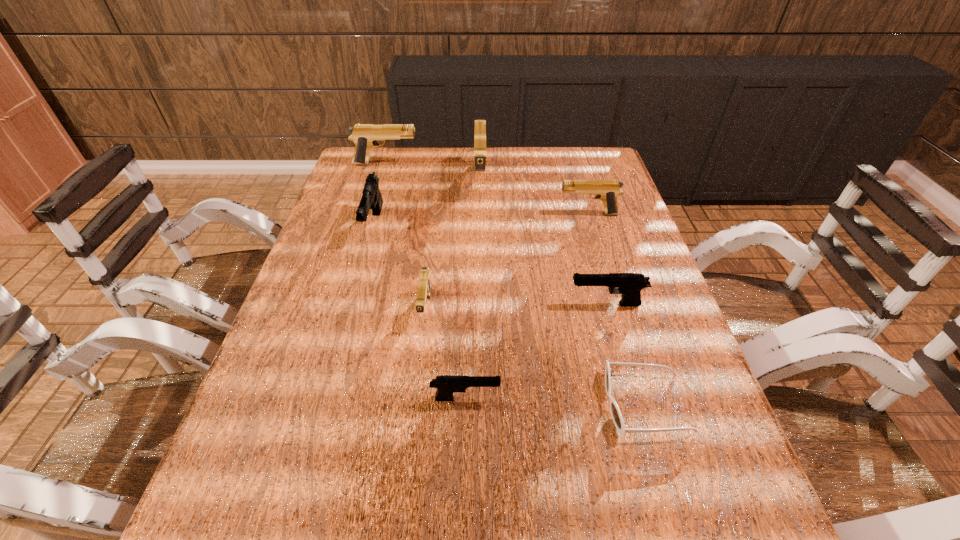
At what (x,y) coordinates should I click in order to perform the action: click on the third tan pistol from right to left. Please return your answer as a coordinate pair (x, y). The height and width of the screenshot is (540, 960). Looking at the image, I should click on (424, 288).

This screenshot has height=540, width=960. I want to click on the smallest black pistol, so click(x=446, y=385).

The height and width of the screenshot is (540, 960). What are the coordinates of `the second black pistol from right to left` in the screenshot? It's located at (446, 385).

Where is `sunglasses`? The image size is (960, 540). sunglasses is located at coordinates (617, 418).

Locate an element on the screen. the shortest object is located at coordinates (617, 418).

Locate an element on the screen. Image resolution: width=960 pixels, height=540 pixels. vacant region located at the barrel of the second tan pistol from right to left is located at coordinates (480, 237).

I want to click on free space located 0.070m at the barrel of the third smallest tan pistol, so click(x=439, y=164).

Where is `vacant area situated on the front-facing side of the biggest black pistol`? vacant area situated on the front-facing side of the biggest black pistol is located at coordinates (357, 283).

Find the location of a particular element. The width and height of the screenshot is (960, 540). vacant space located at the barrel of the rightmost tan pistol is located at coordinates (437, 214).

Locate an element on the screen. The image size is (960, 540). free space located 0.060m at the barrel of the rightmost tan pistol is located at coordinates (538, 214).